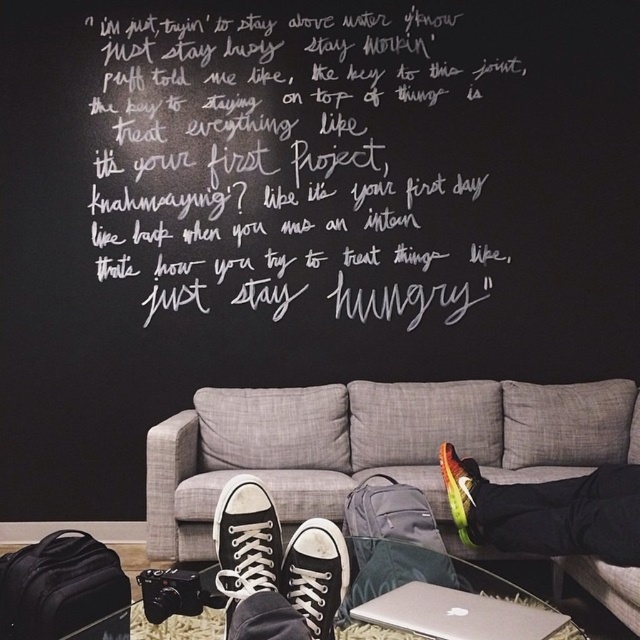
Is gray fabric couch at center positioned in front of black canvas shoe at lower center?

No, it is not.

Does gray fabric couch at center appear on the left side of black canvas shoe at lower center?

No, gray fabric couch at center is not to the left of black canvas shoe at lower center.

Is point (576, 467) farther from viewer compared to point (268, 547)?

Yes, it is.

Identify the location of gray fabric couch at center. (372, 445).

Can you confirm if black canvas shoe at lower center is smaller than multicolored fabric sneaker at lower right?

Yes, black canvas shoe at lower center is smaller than multicolored fabric sneaker at lower right.

Can you confirm if black canvas shoe at lower center is positioned to the left of multicolored fabric sneaker at lower right?

Indeed, black canvas shoe at lower center is positioned on the left side of multicolored fabric sneaker at lower right.

Locate an element on the screen. black canvas shoe at lower center is located at coordinates (244, 540).

Is neon yellow and black sneakers at lower right smaller than black canvas shoe at lower center?

No, neon yellow and black sneakers at lower right is not smaller than black canvas shoe at lower center.

Measure the distance between point (636, 564) and camera.

Point (636, 564) and camera are 2.03 meters apart from each other.

At what (x,y) coordinates should I click in order to perform the action: click on neon yellow and black sneakers at lower right. Please return your answer as a coordinate pair (x, y). Looking at the image, I should click on (547, 512).